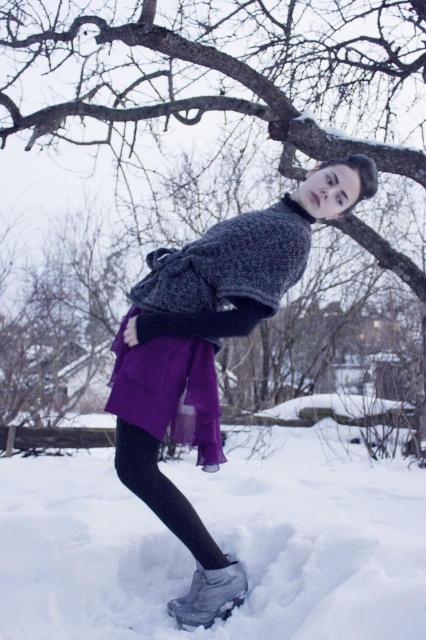
You are a photographer trying to capture a closeup shot of the purple chiffon skirt at lower center while standing on the white fluffy snow at lower center. Is the distance between them sufficient for you to kneel on the snow and still reach the skirt with your camera?

The distance between the white fluffy snow at lower center and the purple chiffon skirt at lower center is 3.42 meters. Since kneeling on the snow would require minimal reach, the 3.42 meters distance is more than enough to kneel and capture the closeup.